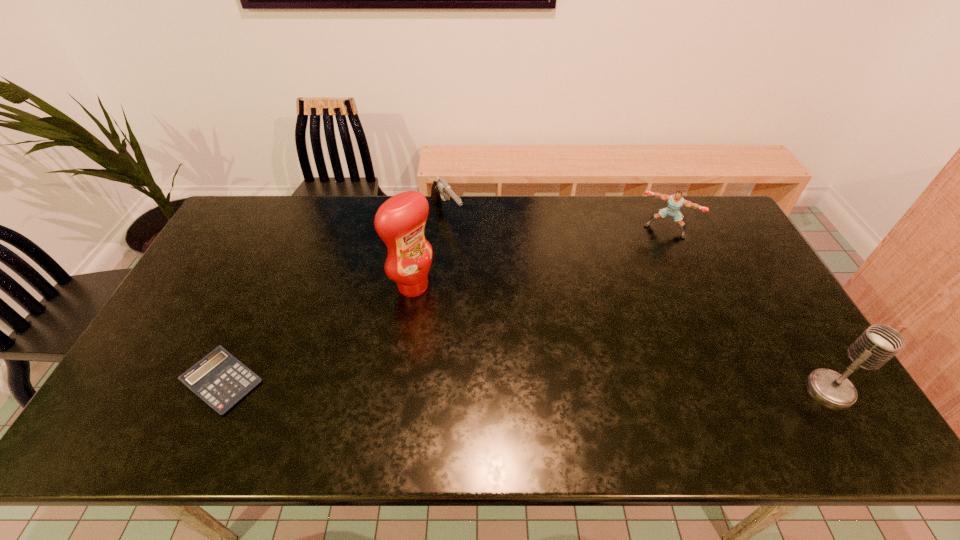
The width and height of the screenshot is (960, 540). What are the coordinates of `gun that is at the far edge` in the screenshot? It's located at (440, 189).

Where is `calculator that is at the near edge`? The width and height of the screenshot is (960, 540). calculator that is at the near edge is located at coordinates (219, 379).

Identify the location of microphone present at the near edge. (878, 343).

The height and width of the screenshot is (540, 960). I want to click on object that is at the left edge, so tap(219, 379).

Where is `microphone at the right edge`? microphone at the right edge is located at coordinates (878, 343).

Locate an element on the screen. puncher situated at the right edge is located at coordinates (675, 202).

The image size is (960, 540). Find the location of `object that is at the near left corner`. object that is at the near left corner is located at coordinates (219, 379).

You are a GUI agent. You are given a task and a screenshot of the screen. Output one action in this format:
    pyautogui.click(x=<x>, y=<y>)
    Task: Click on the object that is positioned at the far right corner
    This screenshot has width=960, height=540.
    Given the screenshot: What is the action you would take?
    pyautogui.click(x=675, y=202)

The width and height of the screenshot is (960, 540). I want to click on object positioned at the near right corner, so click(x=878, y=343).

Find the location of a particular element. This screenshot has width=960, height=540. vacant space at the far edge is located at coordinates (474, 197).